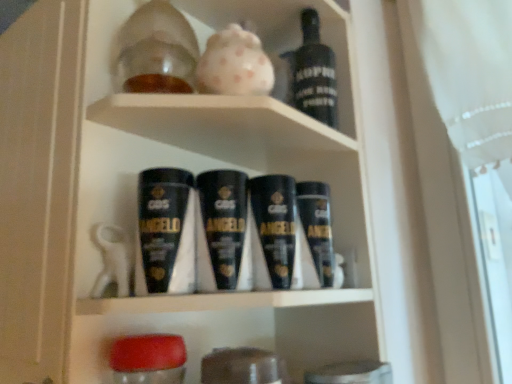
What do you see at coordinates (285, 50) in the screenshot? The height and width of the screenshot is (384, 512). I see `translucent glass jar at upper center` at bounding box center [285, 50].

Describe the element at coordinates (313, 73) in the screenshot. I see `black matte bottle at upper center` at that location.

Describe the element at coordinates (166, 232) in the screenshot. I see `black matte shaving cream at center` at that location.

I want to click on translucent glass jar at upper center, so click(x=285, y=50).

Looking at their sizes, would you say black matte bottle at upper center is wider or thinner than black matte shaving cream at center?

Clearly, black matte bottle at upper center has less width compared to black matte shaving cream at center.

Is black matte bottle at upper center facing away from black matte shaving cream at center?

No, black matte bottle at upper center is not facing away from black matte shaving cream at center.

What's the angular difference between black matte bottle at upper center and black matte shaving cream at center's facing directions?

The angular difference between black matte bottle at upper center and black matte shaving cream at center is 0.00288 degrees.

Between black matte bottle at upper center and black matte shaving cream at center, which one appears on the left side from the viewer's perspective?

black matte shaving cream at center is more to the left.

Does black matte shaving cream at center turn towards black matte bottle at upper center?

No, black matte shaving cream at center is not aimed at black matte bottle at upper center.

Choose the correct answer: Is black matte shaving cream at center inside black matte bottle at upper center or outside it?

black matte shaving cream at center exists outside the volume of black matte bottle at upper center.

Would you say black matte shaving cream at center is to the left or to the right of black matte bottle at upper center in the picture?

In the image, black matte shaving cream at center appears on the left side of black matte bottle at upper center.

Based on the photo, from the image's perspective, is black matte shaving cream at center over black matte bottle at upper center?

No.

Looking at the image, does translucent glass jar at upper center seem bigger or smaller compared to black matte bottle at upper center?

Clearly, translucent glass jar at upper center is larger in size than black matte bottle at upper center.

I want to click on cabinet on the left side of black matte bottle at upper center, so click(x=285, y=50).

Is black matte shaving cream at center inside translucent glass jar at upper center?

No, black matte shaving cream at center is not a part of translucent glass jar at upper center.

Are translucent glass jar at upper center and black matte shaving cream at center far apart?

They are positioned close to each other.

Is translucent glass jar at upper center oriented towards black matte shaving cream at center?

No.

From a real-world perspective, which object rests below the other?

From a 3D spatial view, black matte shaving cream at center is below.

From the image's perspective, is black matte bottle at upper center located above translucent glass jar at upper center?

No, from the image's perspective, black matte bottle at upper center is not on top of translucent glass jar at upper center.

Which of these two, black matte bottle at upper center or translucent glass jar at upper center, stands shorter?

translucent glass jar at upper center is shorter.

Is black matte bottle at upper center not within translucent glass jar at upper center?

Indeed, black matte bottle at upper center is completely outside translucent glass jar at upper center.

Which is more to the right, black matte bottle at upper center or translucent glass jar at upper center?

black matte bottle at upper center is more to the right.

Is black matte shaving cream at center oriented towards translucent glass jar at upper center?

No, black matte shaving cream at center does not turn towards translucent glass jar at upper center.

From the image's perspective, would you say black matte shaving cream at center is shown under translucent glass jar at upper center?

Yes, from the image's perspective, black matte shaving cream at center is beneath translucent glass jar at upper center.

In the image, is black matte shaving cream at center positioned in front of or behind translucent glass jar at upper center?

black matte shaving cream at center is positioned closer to the viewer than translucent glass jar at upper center.

Looking at their sizes, would you say black matte shaving cream at center is wider or thinner than translucent glass jar at upper center?

Considering their sizes, black matte shaving cream at center looks slimmer than translucent glass jar at upper center.

Identify the location of shaving cream in front of the black matte bottle at upper center. (166, 232).

Where is `shaving cream on the left of black matte bottle at upper center`? shaving cream on the left of black matte bottle at upper center is located at coordinates (166, 232).

Considering their positions, is translucent glass jar at upper center positioned further to black matte bottle at upper center than black matte shaving cream at center?

black matte shaving cream at center.

Looking at the image, which one is located closer to black matte bottle at upper center, black matte shaving cream at center or translucent glass jar at upper center?

translucent glass jar at upper center lies closer to black matte bottle at upper center than the other object.

Looking at this image, when comparing their distances from black matte shaving cream at center, does black matte bottle at upper center or translucent glass jar at upper center seem closer?

Based on the image, translucent glass jar at upper center appears to be nearer to black matte shaving cream at center.

Considering their positions, is black matte shaving cream at center positioned further to translucent glass jar at upper center than black matte bottle at upper center?

The object further to translucent glass jar at upper center is black matte shaving cream at center.

From the image, which object appears to be farther from translucent glass jar at upper center, black matte bottle at upper center or black matte shaving cream at center?

black matte shaving cream at center.

In the scene shown: From the image, which object appears to be nearer to black matte shaving cream at center, translucent glass jar at upper center or black matte bottle at upper center?

The object closer to black matte shaving cream at center is translucent glass jar at upper center.

Where is `bottle between translucent glass jar at upper center and black matte shaving cream at center vertically`? The width and height of the screenshot is (512, 384). bottle between translucent glass jar at upper center and black matte shaving cream at center vertically is located at coordinates (313, 73).